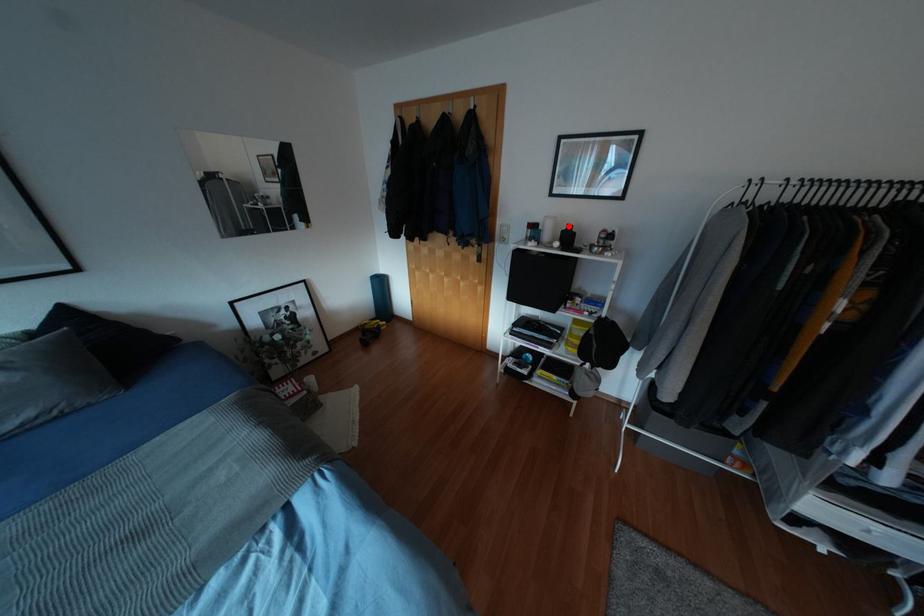
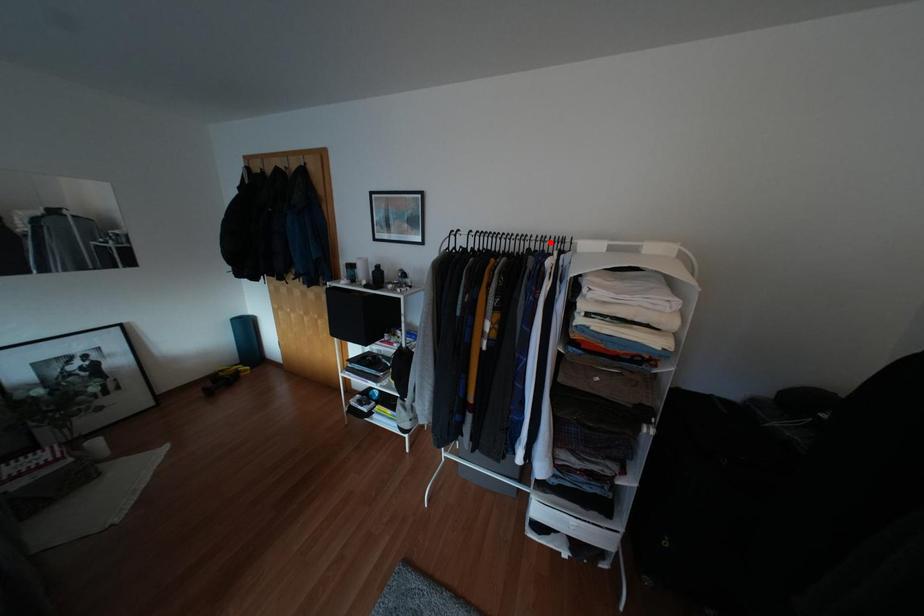
I am providing you with two images of the same scene from different viewpoints. A red point is marked on the first image and another point is marked on the second image. Is the red point in image1 aligned with the point shown in image2?

No